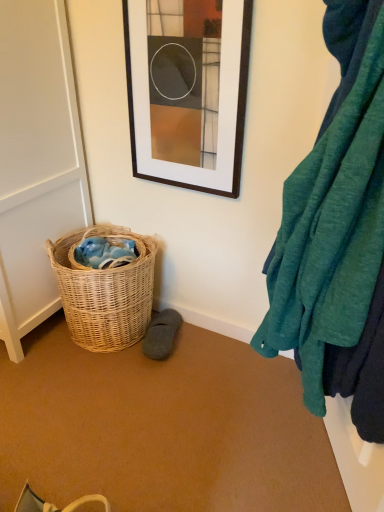
Question: Considering their positions, is white matte screen door at left located in front of or behind woven natural basket at lower left?

Choices:
 (A) front
 (B) behind

Answer: (A)

Question: Is white matte screen door at left taller or shorter than woven natural basket at lower left?

Choices:
 (A) tall
 (B) short

Answer: (A)

Question: Which of these objects is positioned closest to the matte black picture frame at upper center?

Choices:
 (A) gray suede slipper at lower center
 (B) white matte screen door at left
 (C) teal soft fabric at right
 (D) woven natural basket at lower left

Answer: (B)

Question: Estimate the real-world distances between objects in this image. Which object is closer to the matte black picture frame at upper center?

Choices:
 (A) gray suede slipper at lower center
 (B) teal soft fabric at right
 (C) woven natural basket at lower left
 (D) white matte screen door at left

Answer: (D)